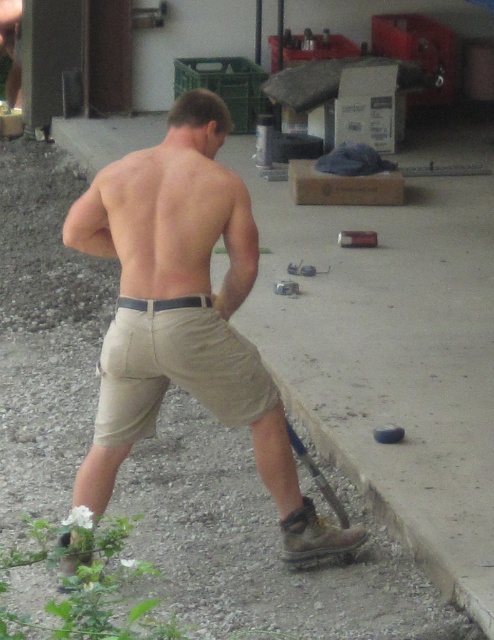
Does tan cotton shorts at center have a smaller size compared to khaki cotton shorts at center?

Actually, tan cotton shorts at center might be larger than khaki cotton shorts at center.

Does tan cotton shorts at center come behind khaki cotton shorts at center?

Yes, it is.

The image size is (494, 640). Describe the element at coordinates (184, 314) in the screenshot. I see `tan cotton shorts at center` at that location.

I want to click on tan cotton shorts at center, so click(x=184, y=314).

From the picture: Is muscular tan skin at back positioned at the back of khaki cotton shorts at center?

That is True.

Measure the distance between muscular tan skin at back and khaki cotton shorts at center.

A distance of 12.86 inches exists between muscular tan skin at back and khaki cotton shorts at center.

Does point (113, 186) lie in front of point (118, 387)?

Yes, point (113, 186) is in front of point (118, 387).

Where is `muscular tan skin at back`? muscular tan skin at back is located at coordinates (164, 218).

Which is below, tan cotton shorts at center or muscular tan skin at back?

tan cotton shorts at center is lower down.

From the picture: Does tan cotton shorts at center have a greater height compared to muscular tan skin at back?

Indeed, tan cotton shorts at center has a greater height compared to muscular tan skin at back.

Image resolution: width=494 pixels, height=640 pixels. In order to click on tan cotton shorts at center in this screenshot , I will do `click(184, 314)`.